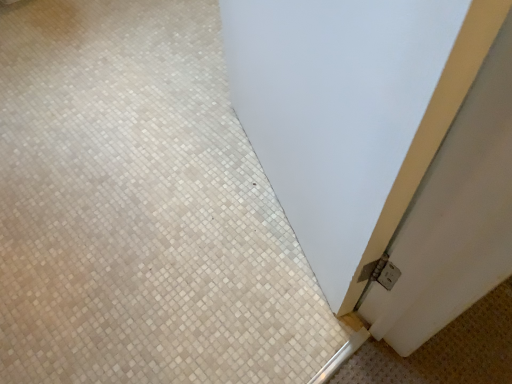
Image resolution: width=512 pixels, height=384 pixels. What are the coordinates of `white mosaic tile at lower left` in the screenshot? It's located at (140, 208).

The height and width of the screenshot is (384, 512). Describe the element at coordinates (140, 208) in the screenshot. I see `white mosaic tile at lower left` at that location.

Locate an element on the screen. Image resolution: width=512 pixels, height=384 pixels. white mosaic tile at lower left is located at coordinates (140, 208).